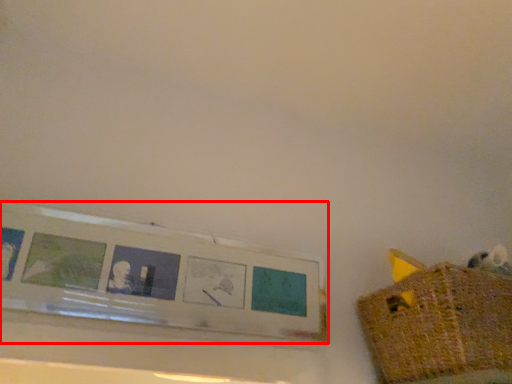
Question: In this image, where is picture frame (annotated by the red box) located relative to basket?

Choices:
 (A) right
 (B) left

Answer: (B)